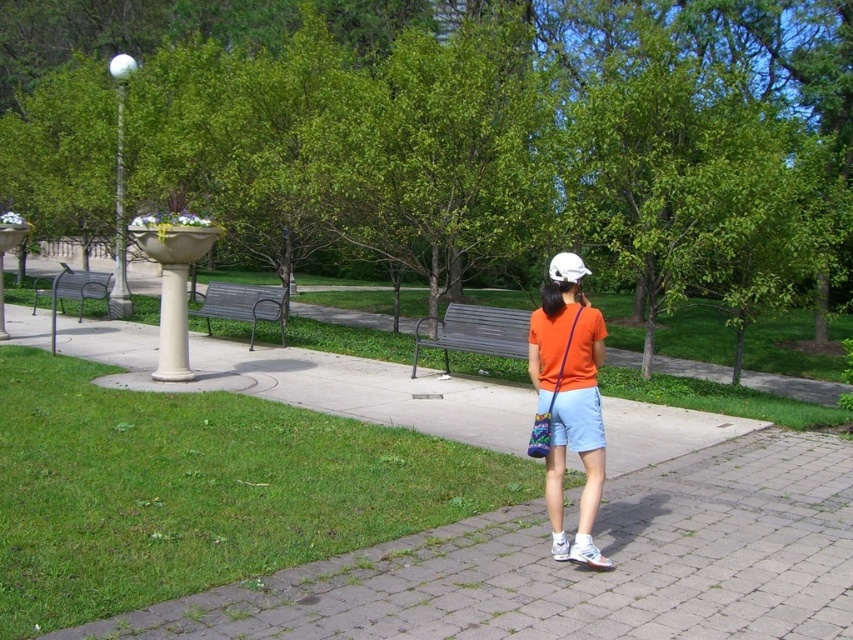
Question: Can you confirm if gray brick pavement at lower center is wider than metallic gray bench at left?

Choices:
 (A) yes
 (B) no

Answer: (B)

Question: Does wooden bench at center appear on the right side of metallic gray bench at center?

Choices:
 (A) no
 (B) yes

Answer: (B)

Question: Which point is closer to the camera taking this photo?

Choices:
 (A) (527, 323)
 (B) (164, 272)

Answer: (B)

Question: Which point appears closest to the camera in this image?

Choices:
 (A) (490, 307)
 (B) (252, 305)
 (C) (57, 284)
 (D) (556, 344)

Answer: (D)

Question: Does gray brick pavement at lower center appear under white marble pillar at left?

Choices:
 (A) no
 (B) yes

Answer: (B)

Question: Which of the following is the closest to the observer?

Choices:
 (A) gray brick pavement at lower center
 (B) orange matte shirt at center
 (C) wooden bench at center
 (D) white marble pillar at left

Answer: (A)